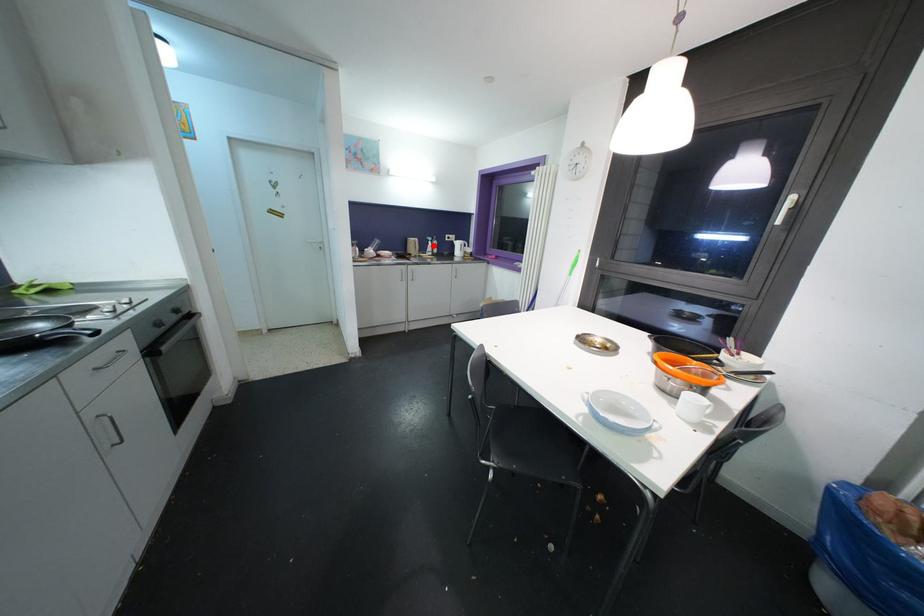
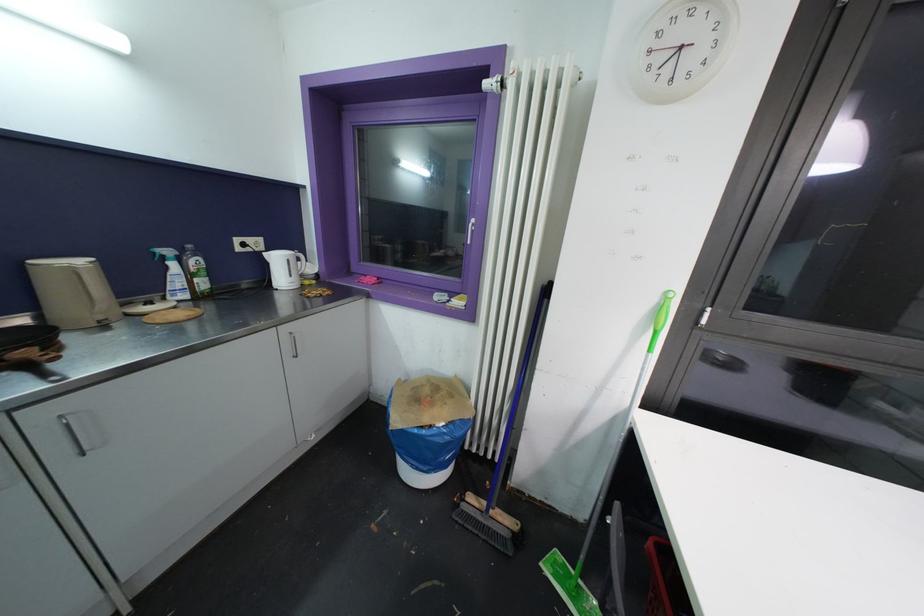
In the second image, find the point that corresponds to the highlighted location in the first image.

(176, 267)